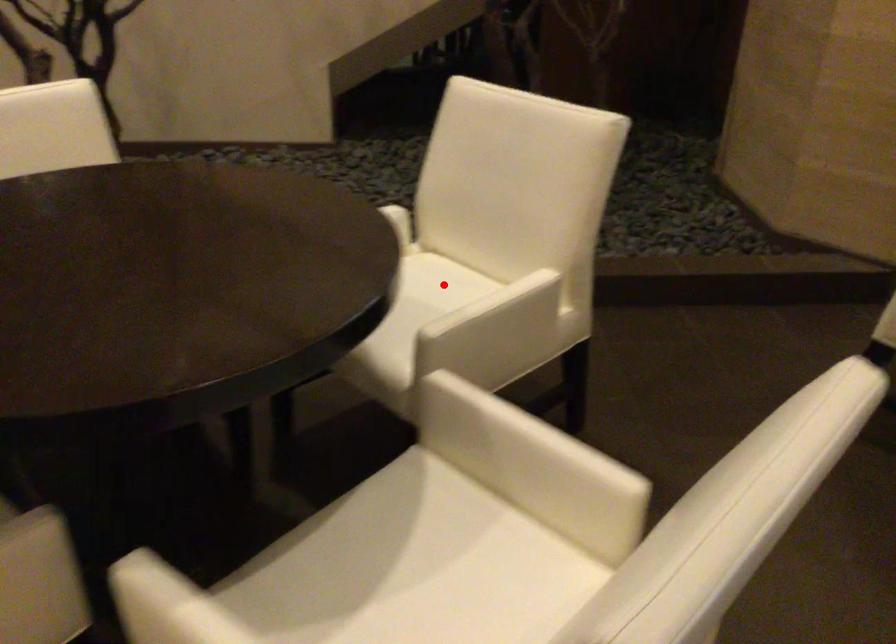
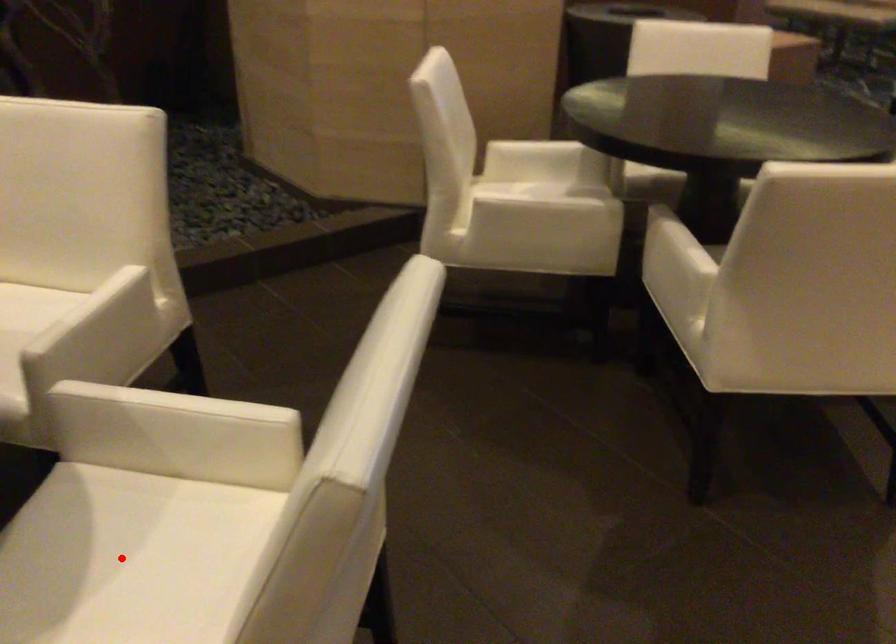
Based on the photo, I am providing you with two images of the same scene from different viewpoints. A red point is marked on the first image and another point is marked on the second image. Are the points marked in image1 and image2 representing the same 3D position?

No